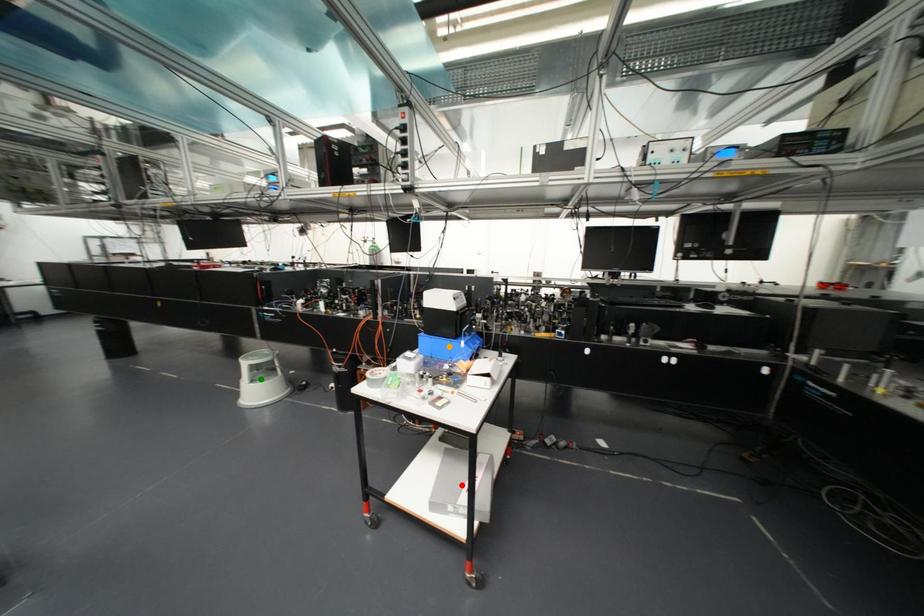
Order these from farthest to nearest:
1. orange point
2. green point
3. red point

green point → orange point → red point